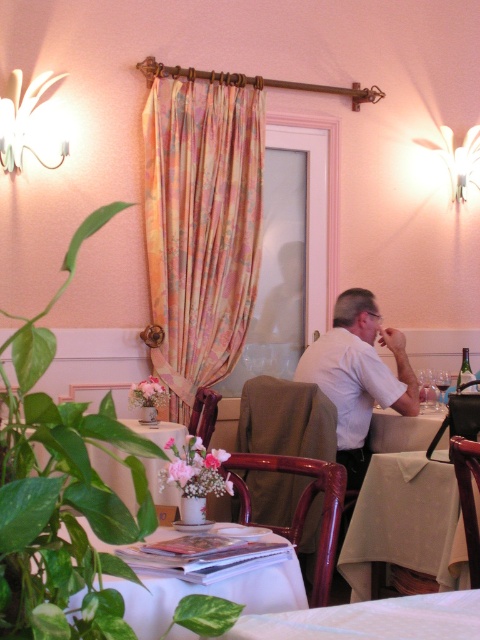
You are a server carrying a tray of dishes and need to move from the kitchen to the smooth beige table at center. There is a brown wood chair at center in the way. Can you navigate around the chair to reach the table without bumping into it?

The distance between the smooth beige table at center and the brown wood chair at center is 3.48 feet. Since 3.48 feet is approximately 41.76 inches, there is enough space for a server to navigate around the chair and reach the table without bumping into it.

You are a server in a restaurant and need to determine which object is bigger between the floral silk curtain at upper left and the white glossy table at lower center. Can you help?

The floral silk curtain at upper left is larger in size than the white glossy table at lower center.